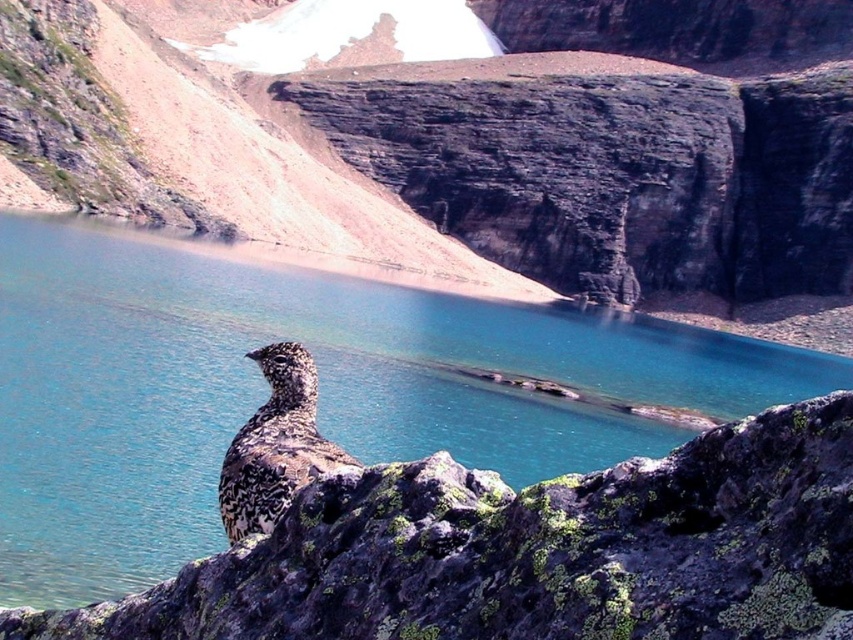
You are standing at the point labeled point (461, 140) in the image. What type of terrain are you currently on?

The point (461, 140) corresponds to the brown rocky hillside at upper center, so you are standing on a rocky hillside.

Consider the image. You are a hiker standing at the point marked by the coordinates point (318,392). Looking around, you see blue water at center. Which direction should you walk to reach the bird perched on the rocky outcrop in the lower left portion of the frame?

The bird is located in the lower left portion of the frame, so from the point marked by the coordinates point (318,392), you should walk towards the lower left direction to reach the bird.